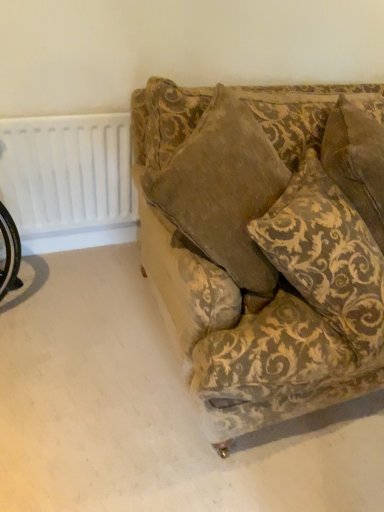
Locate an element on the screen. This screenshot has height=512, width=384. free point below white plastic radiator at upper left (from a real-world perspective) is located at coordinates (90, 247).